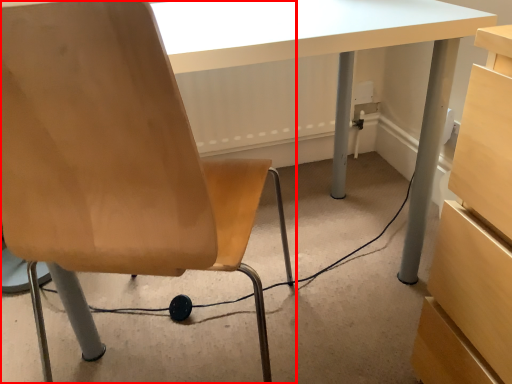
Question: Considering the relative positions of chair (annotated by the red box) and cable in the image provided, where is chair (annotated by the red box) located with respect to the staircase?

Choices:
 (A) left
 (B) right

Answer: (A)